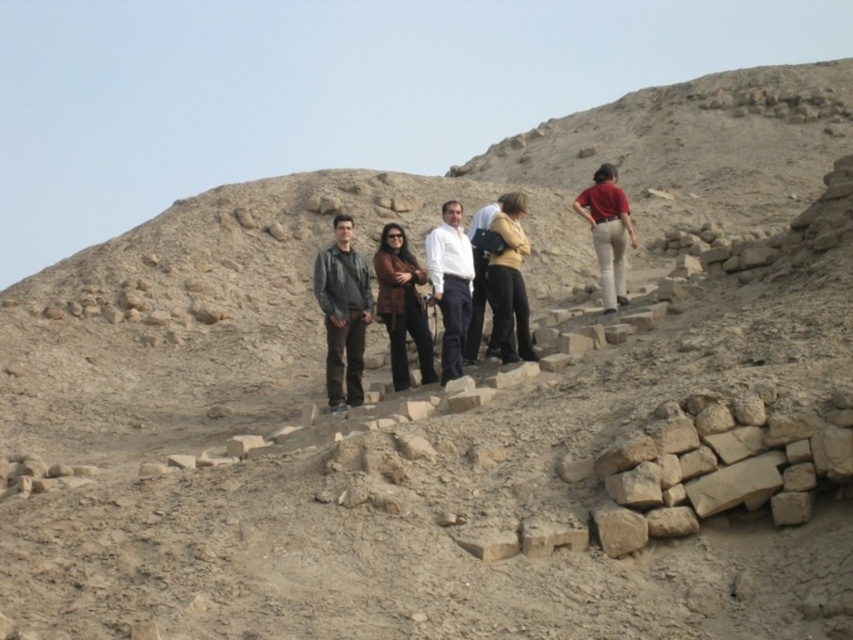
Question: Which of these objects is positioned farthest from the white shirt at center?

Choices:
 (A) dark gray leather jacket at center
 (B) matte red shirt at upper right
 (C) brown leather jacket at center

Answer: (B)

Question: Can you confirm if dark gray leather jacket at center is smaller than matte beige jacket at center?

Choices:
 (A) no
 (B) yes

Answer: (A)

Question: Is brown leather jacket at center wider than white shirt at center?

Choices:
 (A) no
 (B) yes

Answer: (B)

Question: Estimate the real-world distances between objects in this image. Which object is closer to the brown leather jacket at center?

Choices:
 (A) matte red shirt at upper right
 (B) white shirt at center

Answer: (B)

Question: Which of the following is the closest to the observer?

Choices:
 (A) brown leather jacket at center
 (B) dark gray leather jacket at center
 (C) matte beige jacket at center
 (D) matte red shirt at upper right

Answer: (B)

Question: Can you confirm if brown leather jacket at center is smaller than white shirt at center?

Choices:
 (A) no
 (B) yes

Answer: (A)